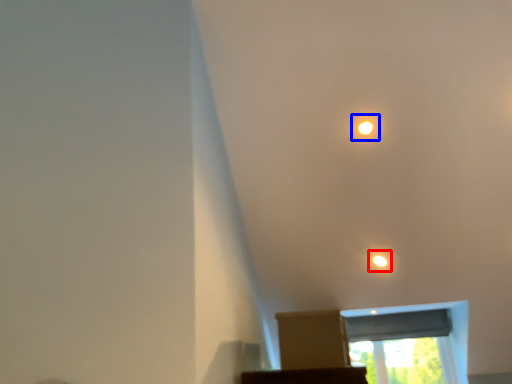
Question: Which object appears farthest to the camera in this image, light (highlighted by a red box) or dot (highlighted by a blue box)?

Choices:
 (A) light
 (B) dot

Answer: (A)